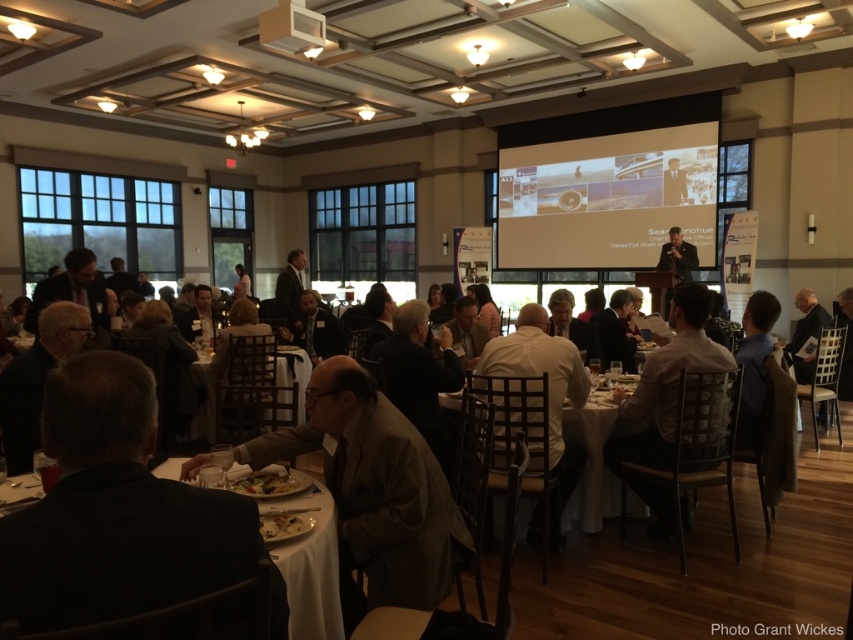
You are at a formal event in a banquet hall and see a point marked at coordinates (311, 561). What is the location of this point relative to the white cloth at lower left?

The point at (311, 561) is located on the white cloth at lower left.

You are a photographer at the event. You want to capture a photo that includes both the white shirt at center and the white leather chair at center. Which object should you focus on first to ensure it appears larger in the photo?

The white shirt at center has a greater height compared to the white leather chair at center, so you should focus on the white shirt at center first to ensure it appears larger in the photo.

You are a guest at the banquet and notice the white cloth at lower left and the golden brown bread at lower center on your table. Which item is closer to the edge of the table?

The white cloth at lower left is located below the golden brown bread at lower center, so it is closer to the edge of the table.